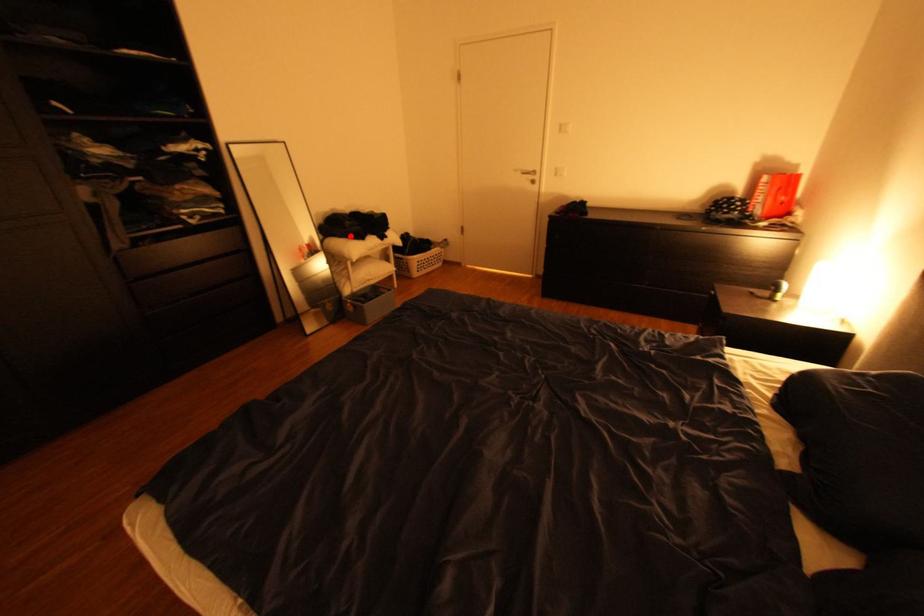
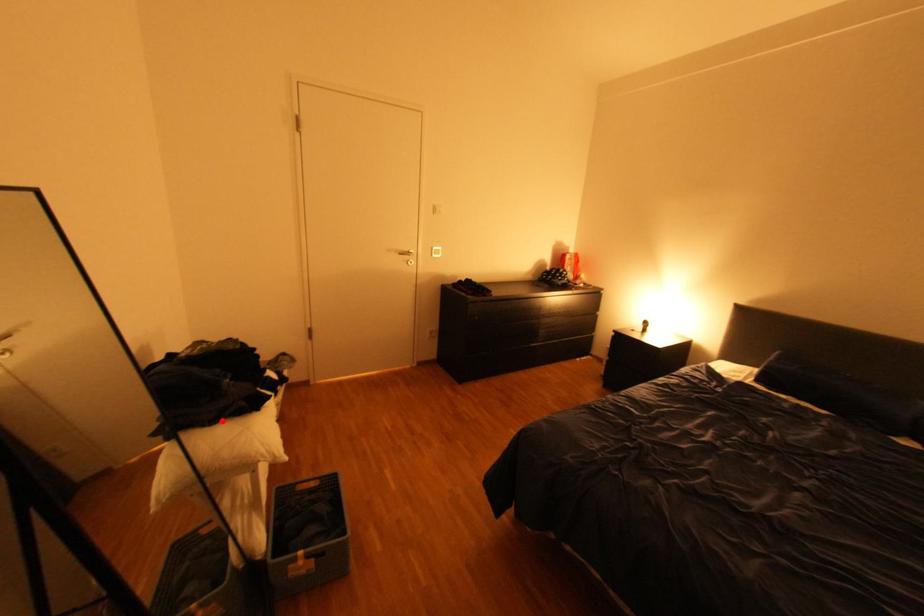
I am providing you with two images of the same scene from different viewpoints. A red point is marked on the first image and another point is marked on the second image. Is the red point in image1 aligned with the point shown in image2?

Yes